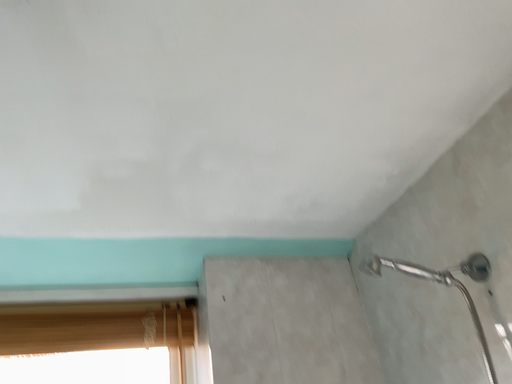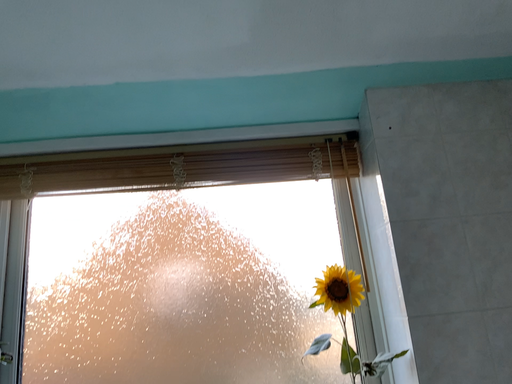
Question: How did the camera likely rotate when shooting the video?

Choices:
 (A) rotated downward
 (B) rotated upward

Answer: (A)